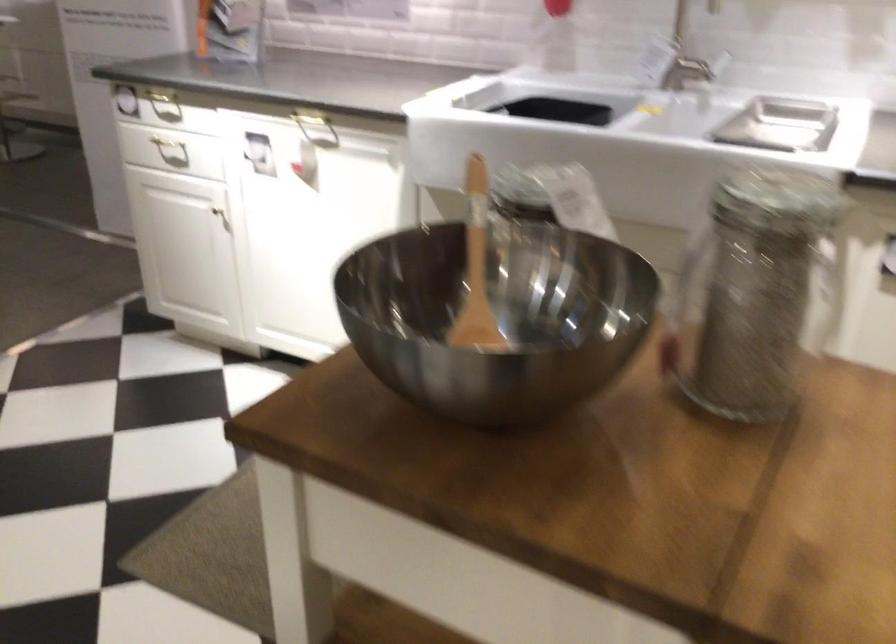
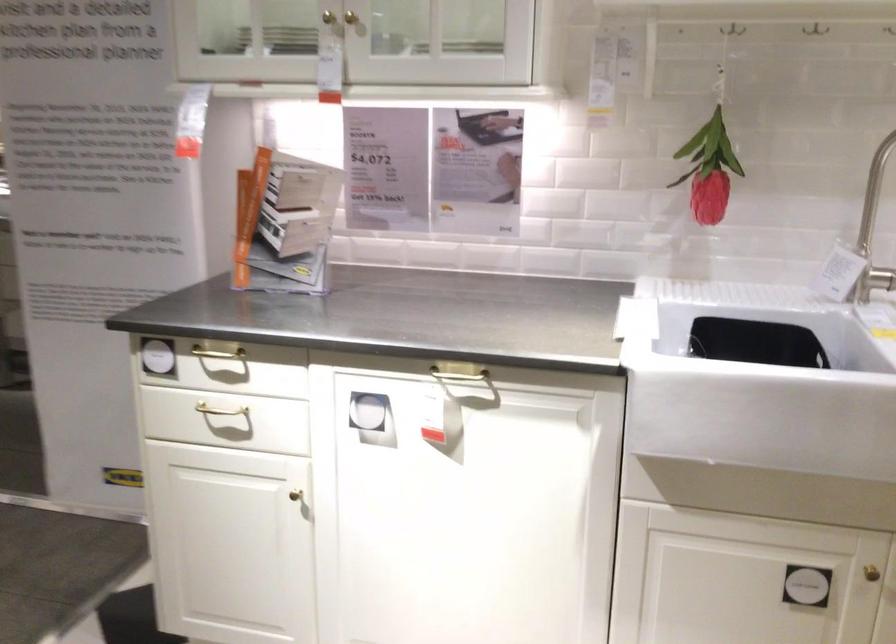
Based on the photo, what movement of the cameraman would produce the second image?

The cameraman moved toward left, forward.